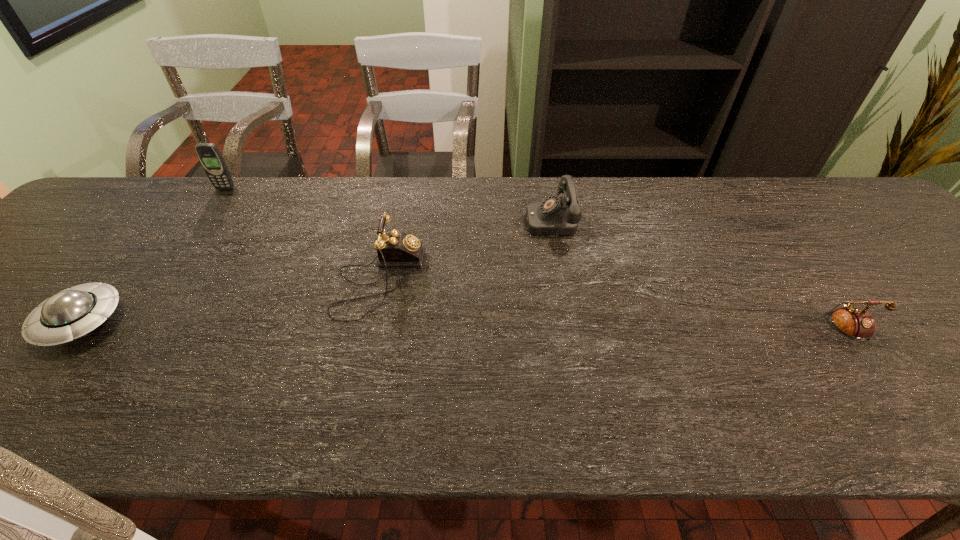
I want to click on blank region between the fourth nearest object and the rightmost object, so click(691, 275).

In order to click on object that is the closest to the third object from left to right in this screenshot , I will do `click(556, 215)`.

Select which object appears as the fourth closest to the leftmost telephone. Please provide its 2D coordinates. Your answer should be formatted as a tuple, i.e. [(x, y)], where the tuple contains the x and y coordinates of a point satisfying the conditions above.

[(855, 323)]

Locate which telephone is the second closest to the rightmost object. Please provide its 2D coordinates. Your answer should be formatted as a tuple, i.e. [(x, y)], where the tuple contains the x and y coordinates of a point satisfying the conditions above.

[(395, 249)]

Image resolution: width=960 pixels, height=540 pixels. Find the location of `telephone identified as the closest to the rightmost telephone`. telephone identified as the closest to the rightmost telephone is located at coordinates (556, 215).

In order to click on free spot that satisfies the following two spatial constraints: 1. on the dial of the third object from left to right; 2. on the front side of the saucer in this screenshot , I will do `click(370, 321)`.